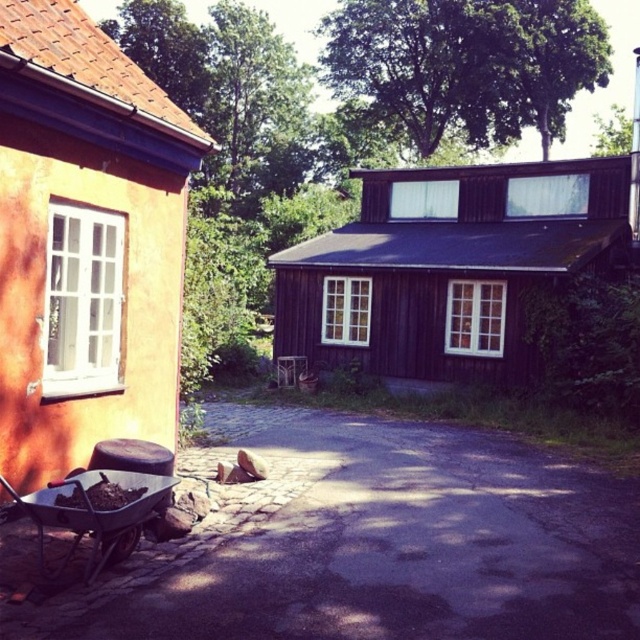
You are standing at the edge of the dark gray asphalt at center and want to move towards the metallic wheelbarrow at lower left. Which direction should you face to walk directly towards it?

You should face to the left because the metallic wheelbarrow at lower left is to the left of the dark gray asphalt at center.

What is the location of the dark gray asphalt at center in the image?

The dark gray asphalt at center is located at point coordinates of 0.853 on the x axis and 0.577 on the y axis.

Based on the photo, you are a gardener with a 0.8 meters wide wheelbarrow. You want to move your metallic wheelbarrow at lower left to the dark gray asphalt at center. Is there enough space to maneuver it there without hitting anything?

The distance between the dark gray asphalt at center and the metallic wheelbarrow at lower left is 1.09 meters. Since the wheelbarrow is 0.8 meters wide, there is sufficient space to move it there without obstruction.